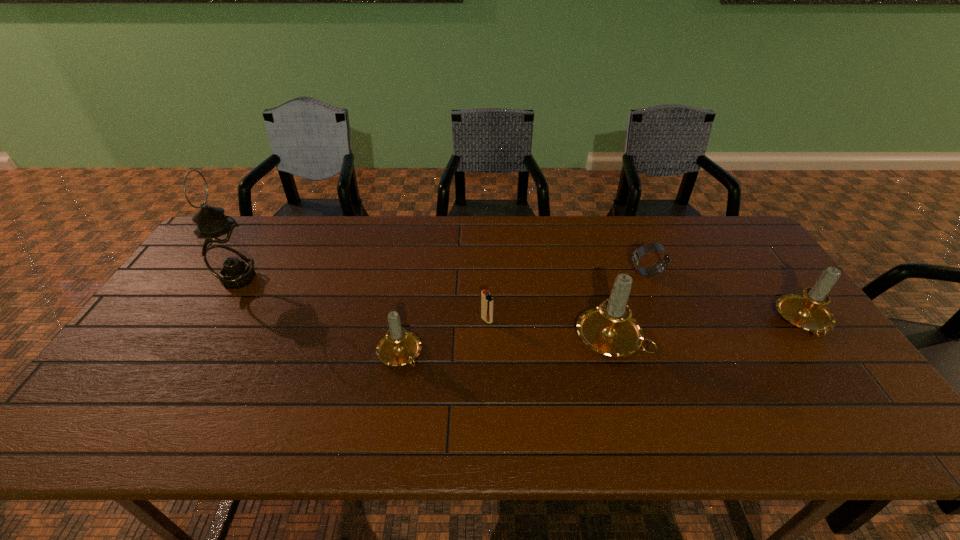
Identify the location of the shortest candle. (398, 347).

Find the location of a particular element. This screenshot has height=540, width=960. the fifth object from right to left is located at coordinates (398, 347).

The image size is (960, 540). I want to click on the second candle from right to left, so click(x=609, y=329).

This screenshot has width=960, height=540. I want to click on the tallest candle, so click(x=609, y=329).

Identify the location of the rightmost object. (807, 311).

The width and height of the screenshot is (960, 540). In order to click on the rightmost candle in this screenshot , I will do `click(807, 311)`.

You are a GUI agent. You are given a task and a screenshot of the screen. Output one action in this format:
    pyautogui.click(x=<x>, y=<y>)
    Task: Click on the oil lamp
    The image size is (960, 540).
    Given the screenshot: What is the action you would take?
    pyautogui.click(x=224, y=251)

Where is `the tallest object`? This screenshot has height=540, width=960. the tallest object is located at coordinates (224, 251).

Image resolution: width=960 pixels, height=540 pixels. In order to click on igniter in this screenshot , I will do `click(486, 300)`.

Identify the location of the second object from right to left. Image resolution: width=960 pixels, height=540 pixels. (636, 257).